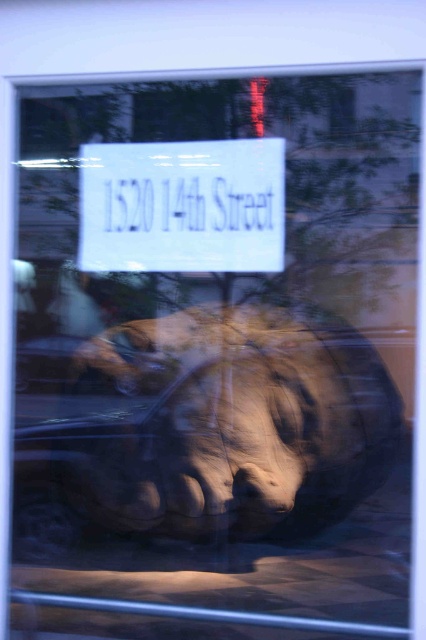
You are standing in a room and looking at the window reflection. You see the matte brown sculpture at center and the white paper sign at center. Which object is closer to the left side of the window?

The white paper sign at center is closer to the left side of the window because the matte brown sculpture at center is to the right of it.

You are an interior designer planning to hang two white paper signs in a room. The signs are labeled as the white paper sign at center and the white paper sign at upper center. Based on the scene, which sign should you place higher up to maintain the same reflection perspective?

To maintain the same reflection perspective, you should place the white paper sign at upper center higher up since in the scene, the white paper sign at center is taller than the white paper sign at upper center, implying the latter is positioned higher and thus appears smaller in the reflection.